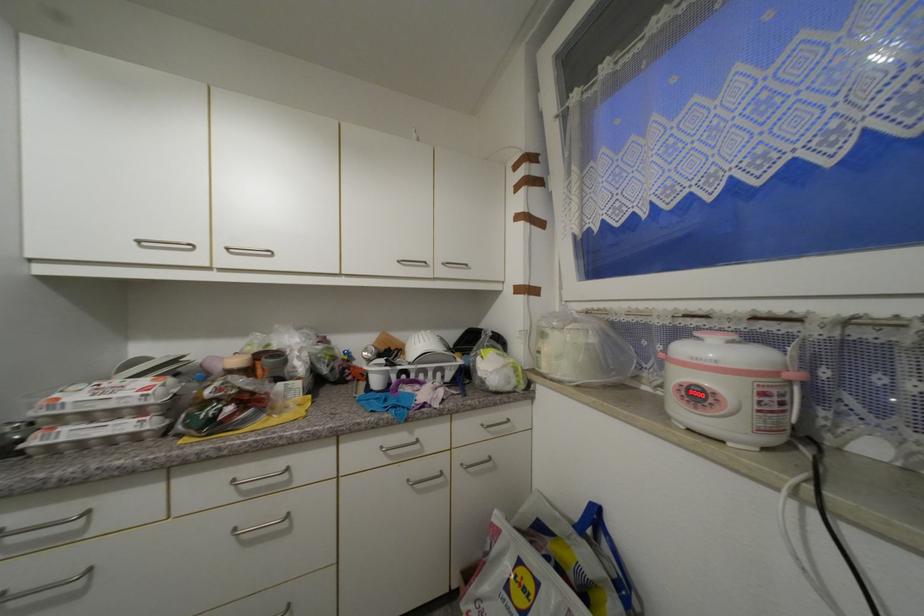
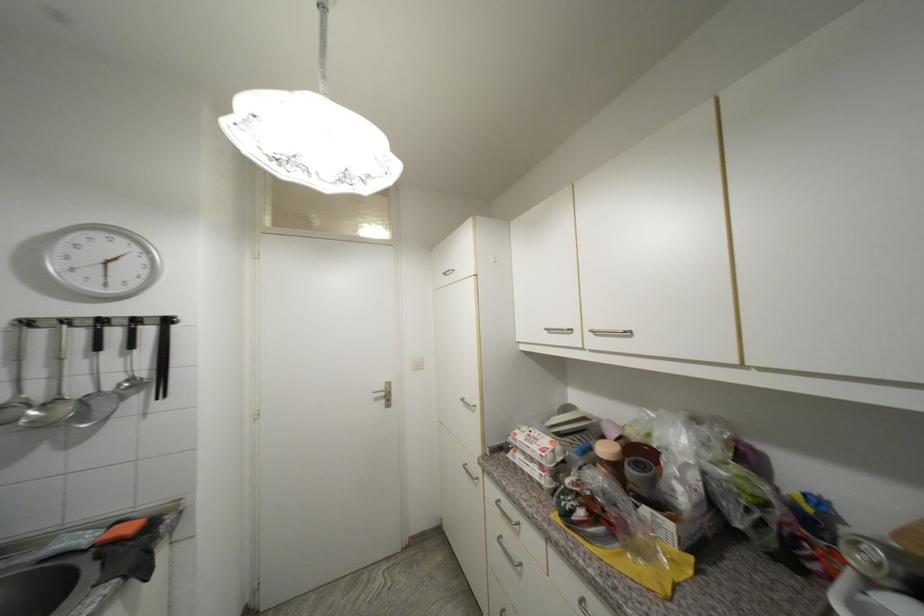
In the second image, find the point that corresponds to (x=253, y=373) in the first image.

(622, 469)